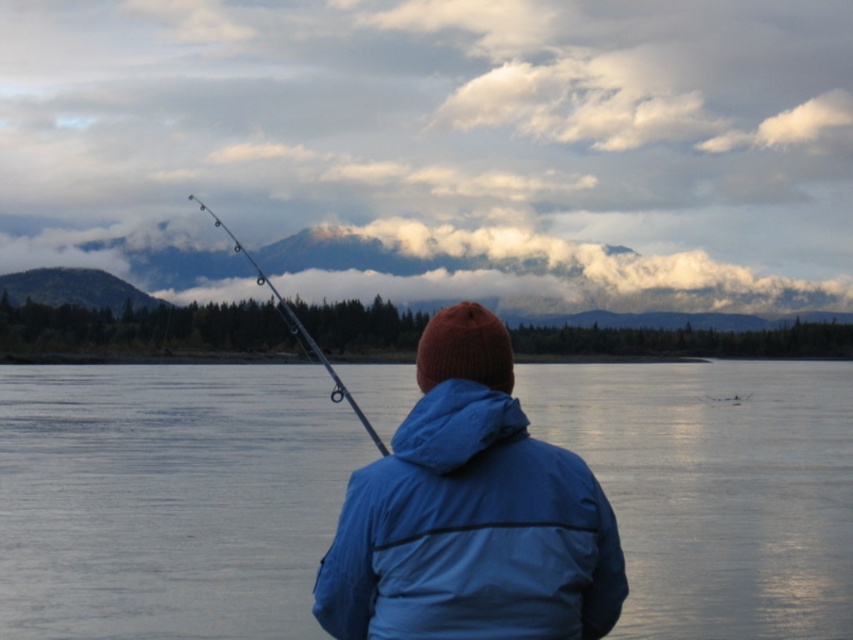
Question: Which object is positioned farthest from the blue fabric jacket at center?

Choices:
 (A) smooth water at center
 (B) metallic rod at upper center

Answer: (A)

Question: Can you confirm if smooth water at center is positioned above metallic rod at upper center?

Choices:
 (A) no
 (B) yes

Answer: (A)

Question: Does blue fabric jacket at center appear on the left side of metallic rod at upper center?

Choices:
 (A) no
 (B) yes

Answer: (A)

Question: Is smooth water at center to the right of blue fabric jacket at center from the viewer's perspective?

Choices:
 (A) no
 (B) yes

Answer: (B)

Question: Which of the following is the farthest from the observer?

Choices:
 (A) pyautogui.click(x=251, y=592)
 (B) pyautogui.click(x=409, y=483)

Answer: (A)

Question: Which point appears closest to the camera in this image?

Choices:
 (A) (285, 321)
 (B) (619, 422)

Answer: (A)